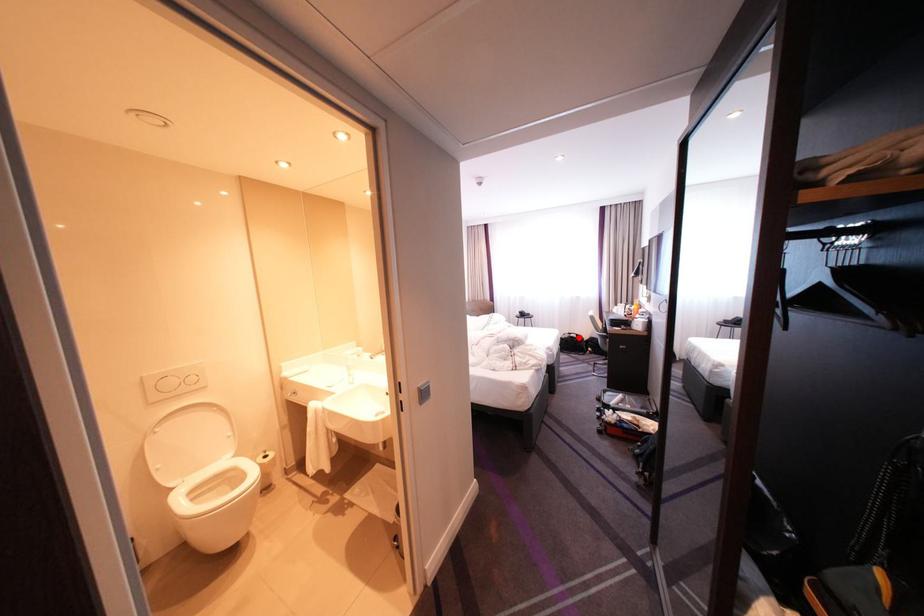
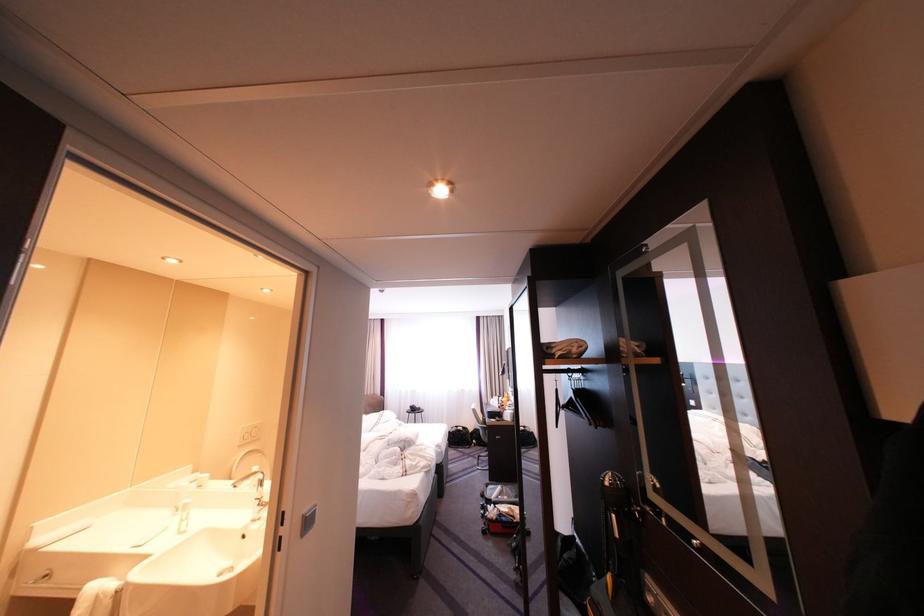
The point at the highlighted location is marked in the first image. Where is the corresponding point in the second image?

(467, 431)